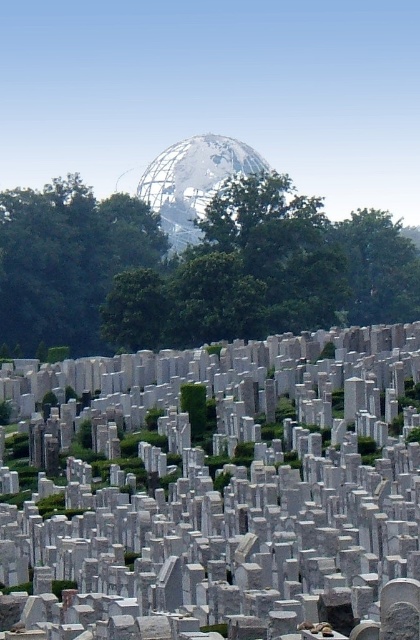
Does green leafy tree at upper center have a greater height compared to green leafy tree at center?

No, green leafy tree at upper center is not taller than green leafy tree at center.

Can you confirm if green leafy tree at upper center is positioned above green leafy tree at center?

Yes.

Who is more forward, (10, 225) or (7, 204)?

Point (10, 225) is in front.

Locate an element on the screen. green leafy tree at upper center is located at coordinates (191, 269).

Between point (23, 528) and point (231, 272), which one is positioned in front?

Point (23, 528) is in front.

Is white marble gravestone at center closer to the viewer compared to green leafy tree at upper center?

Yes.

Is point (173, 522) closer to camera compared to point (120, 298)?

Yes, point (173, 522) is in front of point (120, 298).

Find the location of `white marble gravestone at center`. white marble gravestone at center is located at coordinates (217, 492).

Is white marble gravestone at center to the left of green leafy tree at center from the viewer's perspective?

No, white marble gravestone at center is not to the left of green leafy tree at center.

Can you confirm if white marble gravestone at center is smaller than green leafy tree at center?

Indeed, white marble gravestone at center has a smaller size compared to green leafy tree at center.

Find the location of a particular element. The height and width of the screenshot is (640, 420). white marble gravestone at center is located at coordinates pyautogui.click(x=217, y=492).